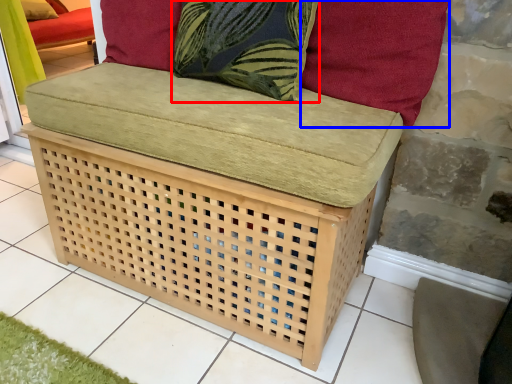
Question: Which object appears closest to the camera in this image, throw pillow (highlighted by a red box) or pillow (highlighted by a blue box)?

Choices:
 (A) throw pillow
 (B) pillow

Answer: (B)